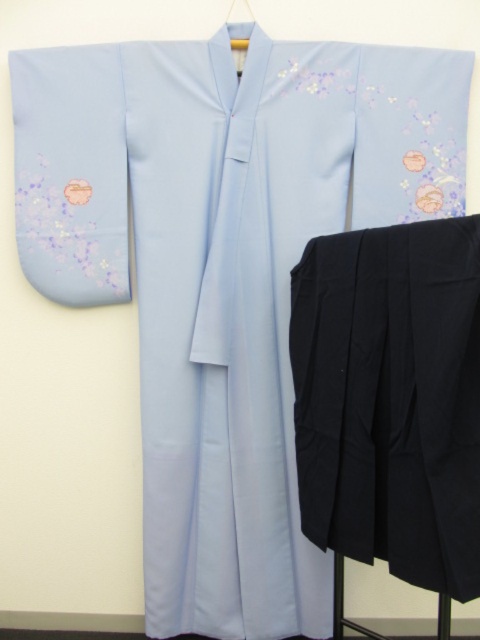
Does black matte pants at lower right have a larger size compared to matte plastic hanger at upper center?

Correct, black matte pants at lower right is larger in size than matte plastic hanger at upper center.

Between black matte pants at lower right and matte plastic hanger at upper center, which one is positioned higher?

matte plastic hanger at upper center is higher up.

I want to click on black matte pants at lower right, so click(391, 397).

Identify the location of black matte pants at lower right. (391, 397).